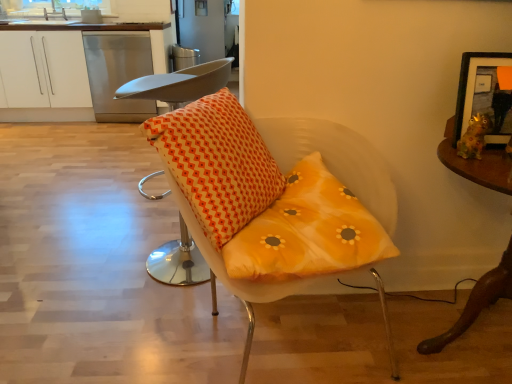
This screenshot has width=512, height=384. In order to click on free space to the left of orange fabric cushion at center, arranged as the 1th chair when viewed from the left in this screenshot , I will do [x=108, y=261].